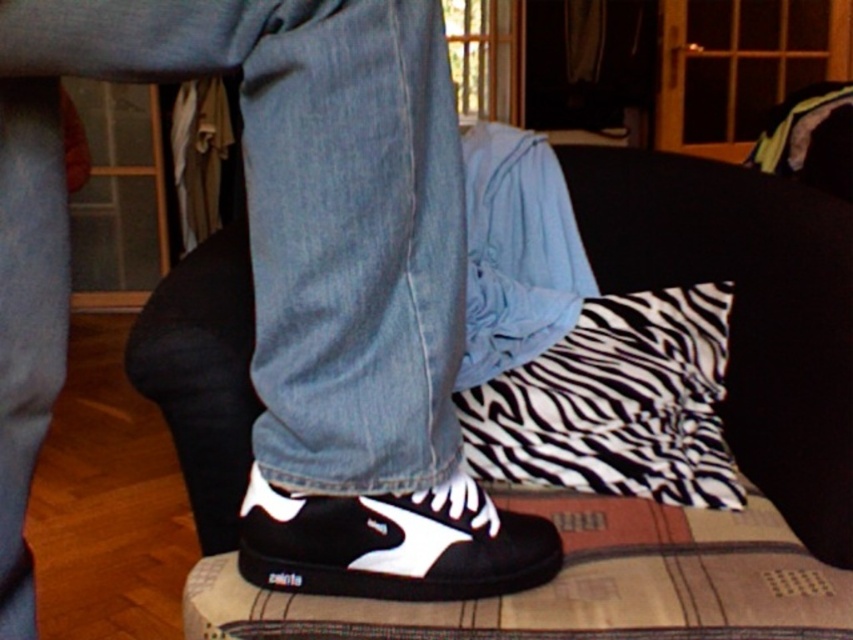
In the scene shown: Who is lower down, zebra-patterned fabric at center or black canvas shoe at center?

Positioned lower is black canvas shoe at center.

Which is more to the right, zebra-patterned fabric at center or black canvas shoe at center?

From the viewer's perspective, zebra-patterned fabric at center appears more on the right side.

Identify the location of zebra-patterned fabric at center. (746, 308).

Identify the location of zebra-patterned fabric at center. The height and width of the screenshot is (640, 853). (746, 308).

Is black matte sneakers at center wider than black canvas shoe at center?

Correct, the width of black matte sneakers at center exceeds that of black canvas shoe at center.

Does black matte sneakers at center come behind black canvas shoe at center?

No, it is not.

Describe the element at coordinates (283, 285) in the screenshot. The height and width of the screenshot is (640, 853). I see `black matte sneakers at center` at that location.

Find the location of a particular element. Image resolution: width=853 pixels, height=640 pixels. black matte sneakers at center is located at coordinates (283, 285).

Can you confirm if black matte sneakers at center is taller than zebra-patterned fabric at center?

Yes.

Between point (12, 504) and point (229, 454), which one is positioned in front?

Point (12, 504) is in front.

Identify the location of black matte sneakers at center. Image resolution: width=853 pixels, height=640 pixels. (283, 285).